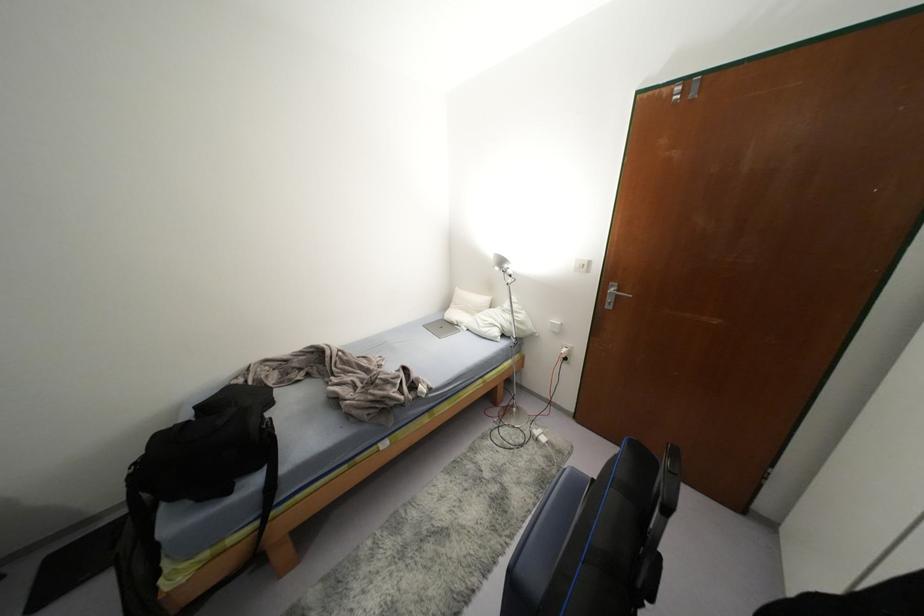
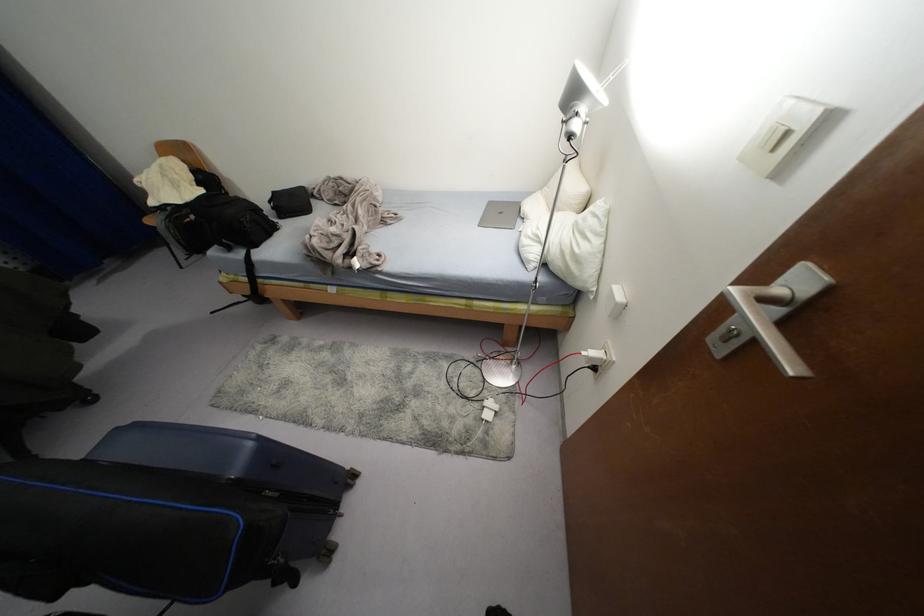
The point at (x=557, y=322) is marked in the first image. Where is the corresponding point in the second image?

(619, 299)